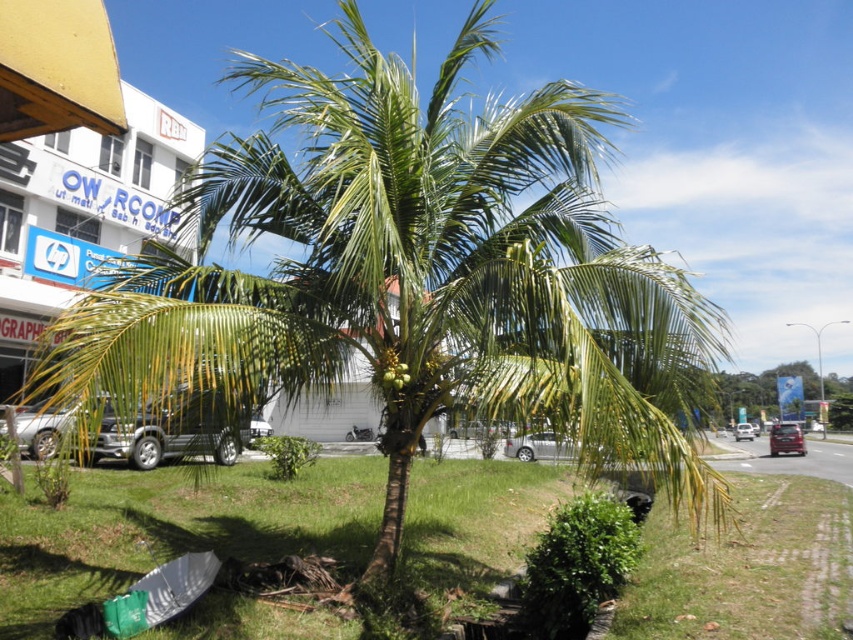
You are standing in the outdoor scene with the coconut palm tree. There are two points marked on the image. The first point is at coordinates point (543, 454) and the second point is at coordinates point (802, 449). Which point is closer to you?

Point (543, 454) is in front of point (802, 449), so it is closer to you.

You are standing in front of the coconut palm tree and want to reach the point at coordinates point (846,376). Given that the coconut palm tree is between you and that point, can you safely walk straight towards it without going around the tree?

The point (846,376) is 212.28 feet away from the viewer, so you can safely walk straight towards it without going around the coconut palm tree since the distance is sufficient to navigate around the tree if needed.

You are a delivery driver who needs to park your car between the silver metallic car at center and the metallic silver car at center. However, you notice that one of them might be wider than the other. Which car should you park next to to ensure there is enough space for your vehicle?

The silver metallic car at center might be wider than metallic silver car at center, so you should park next to the metallic silver car at center to ensure there is enough space for your vehicle.